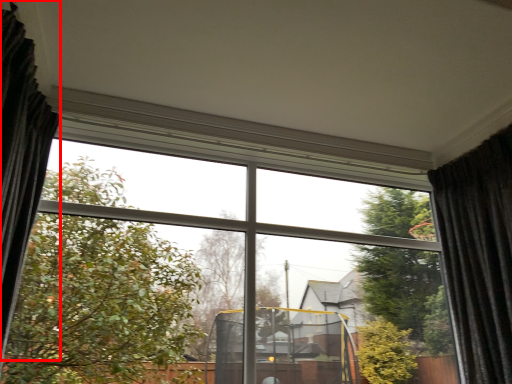
Question: From the image's perspective, what is the correct spatial relationship of curtain (annotated by the red box) in relation to curtain?

Choices:
 (A) above
 (B) below

Answer: (A)